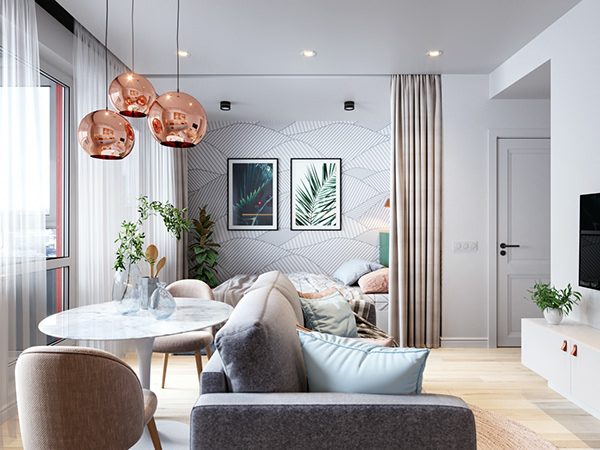
Locate an element on the screen. door on other sidefront door is located at coordinates (519, 189).